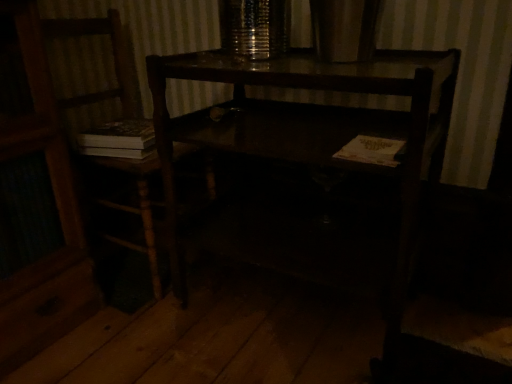
Question: From a real-world perspective, is dark wood desk at center below wooden chair at left?

Choices:
 (A) yes
 (B) no

Answer: (A)

Question: Is the depth of dark wood desk at center greater than that of wooden chair at left?

Choices:
 (A) no
 (B) yes

Answer: (A)

Question: Would you consider dark wood desk at center to be distant from wooden chair at left?

Choices:
 (A) no
 (B) yes

Answer: (A)

Question: Can you confirm if dark wood desk at center is bigger than wooden chair at left?

Choices:
 (A) no
 (B) yes

Answer: (B)

Question: Does dark wood desk at center turn towards wooden chair at left?

Choices:
 (A) yes
 (B) no

Answer: (B)

Question: In the image, is dark wood desk at center positioned in front of or behind wooden chair at left?

Choices:
 (A) front
 (B) behind

Answer: (A)

Question: Is dark wood desk at center taller or shorter than wooden chair at left?

Choices:
 (A) short
 (B) tall

Answer: (A)

Question: Is dark wood desk at center wider or thinner than wooden chair at left?

Choices:
 (A) thin
 (B) wide

Answer: (B)

Question: From the image's perspective, is dark wood desk at center located above or below wooden chair at left?

Choices:
 (A) below
 (B) above

Answer: (A)

Question: From a real-world perspective, relative to white paper book at lower right, is dark wood desk at center vertically above or below?

Choices:
 (A) below
 (B) above

Answer: (A)

Question: Is point (412, 246) positioned closer to the camera than point (370, 150)?

Choices:
 (A) farther
 (B) closer

Answer: (A)

Question: Which is correct: dark wood desk at center is inside white paper book at lower right, or outside of it?

Choices:
 (A) inside
 (B) outside

Answer: (B)

Question: Looking at the image, does dark wood desk at center seem bigger or smaller compared to white paper book at lower right?

Choices:
 (A) small
 (B) big

Answer: (B)

Question: Considering the positions of point (381, 152) and point (210, 173), is point (381, 152) closer or farther from the camera than point (210, 173)?

Choices:
 (A) farther
 (B) closer

Answer: (B)

Question: Which is correct: white paper book at lower right is inside wooden chair at left, or outside of it?

Choices:
 (A) inside
 (B) outside

Answer: (B)